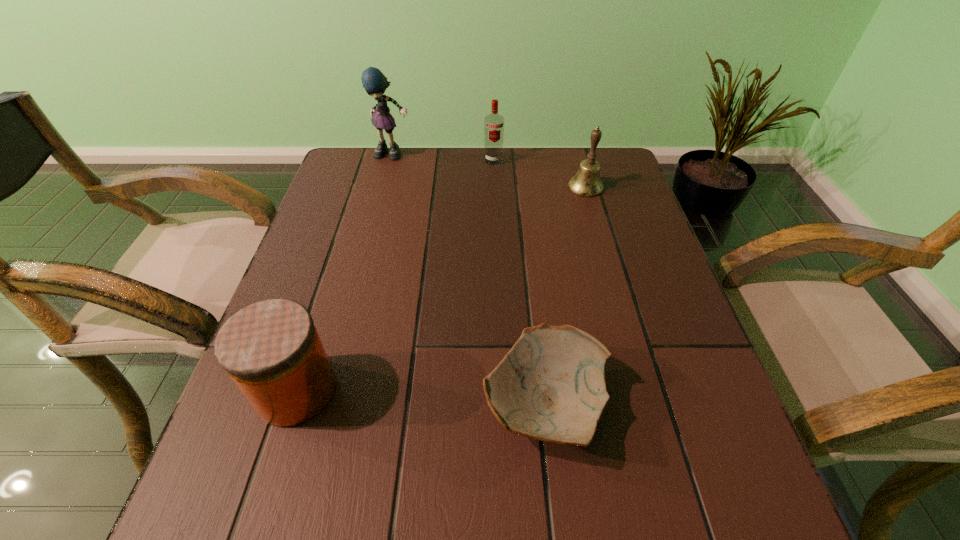
Locate an element on the screen. the tallest object is located at coordinates (374, 82).

This screenshot has height=540, width=960. I want to click on vodka, so click(493, 123).

Find the location of a particular element. This screenshot has width=960, height=540. the rightmost object is located at coordinates (586, 183).

This screenshot has height=540, width=960. What are the coordinates of `bell` in the screenshot? It's located at (586, 183).

This screenshot has width=960, height=540. Find the location of `jar`. jar is located at coordinates (271, 350).

Locate an element on the screen. pottery is located at coordinates (551, 385).

In order to click on vacant space situated 0.150m on the front-facing side of the rag doll in this screenshot , I will do `click(384, 192)`.

Locate an element on the screen. vacant space situated 0.300m on the front label of the vodka is located at coordinates (496, 234).

Where is `vacant space situated 0.280m on the front of the bell`? This screenshot has width=960, height=540. vacant space situated 0.280m on the front of the bell is located at coordinates (611, 274).

Where is `vacant space located 0.110m on the right of the jar`? The image size is (960, 540). vacant space located 0.110m on the right of the jar is located at coordinates (399, 390).